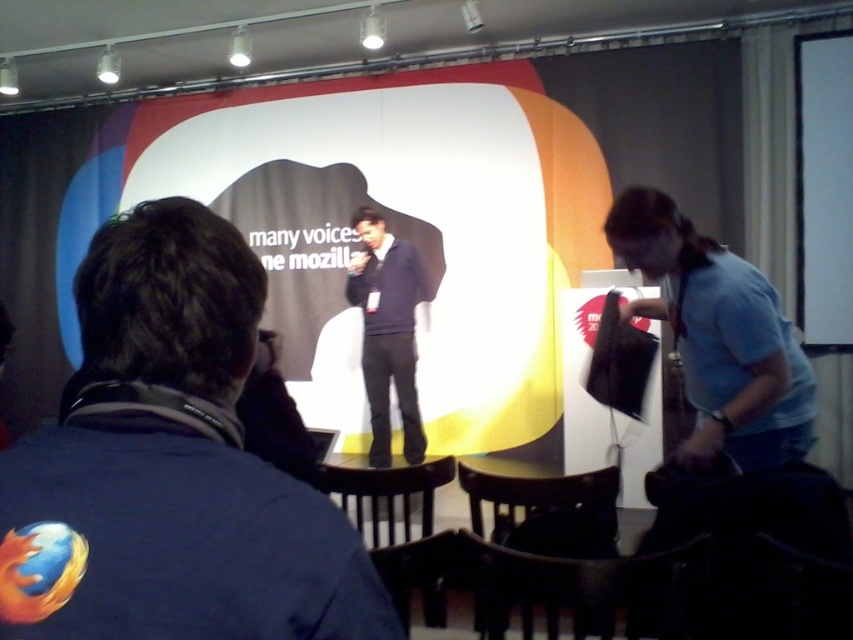
Question: In this image, where is light blue fabric shirt at right located relative to dark blue sweater at center?

Choices:
 (A) right
 (B) left

Answer: (A)

Question: Can you confirm if blue denim jacket at center is positioned below light blue fabric shirt at right?

Choices:
 (A) no
 (B) yes

Answer: (B)

Question: Which point is farther to the camera?

Choices:
 (A) (399, 312)
 (B) (767, 342)

Answer: (A)

Question: Which point is farther to the camera?

Choices:
 (A) (691, 444)
 (B) (196, 428)
 (C) (397, 289)

Answer: (C)

Question: Does light blue fabric shirt at right have a smaller size compared to dark blue sweater at center?

Choices:
 (A) no
 (B) yes

Answer: (A)

Question: Which point is farther to the camera?

Choices:
 (A) (712, 291)
 (B) (97, 336)

Answer: (A)